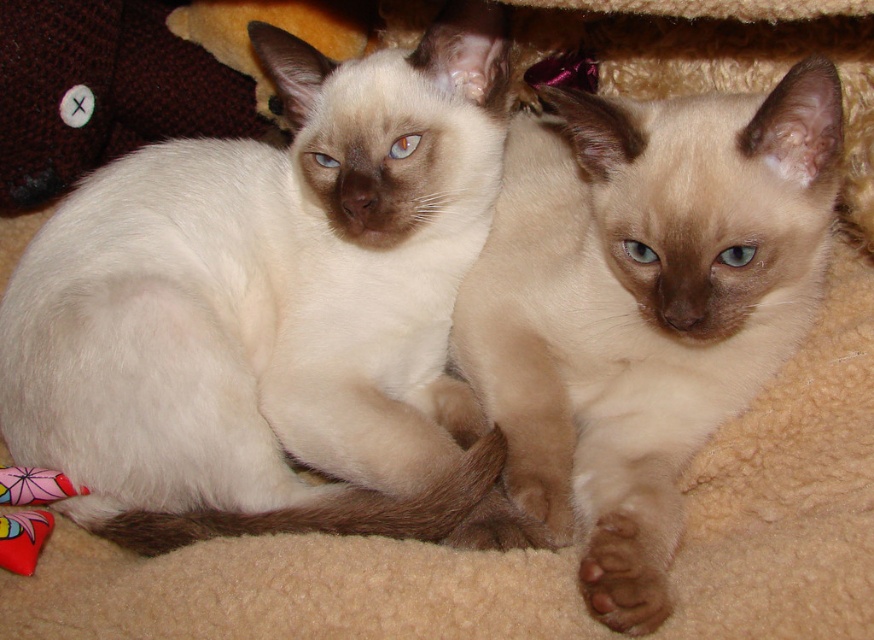
You are a photographer trying to capture the two cats in the image. Since you want to ensure the silky white cat at center and the silky cream cat at center are both visible in the frame, which cat should you focus on first to make sure the other is also in focus?

The silky white cat at center is above the silky cream cat at center, so focusing on the silky white cat at center first will ensure the silky cream cat at center is also in focus because it is positioned below.